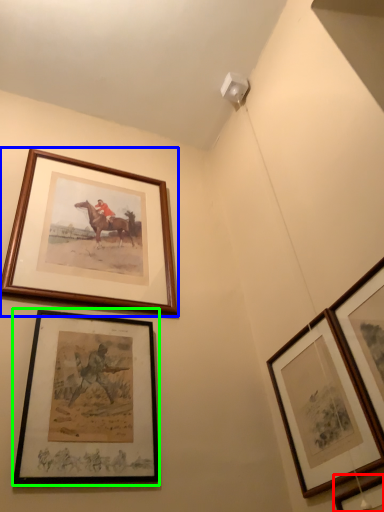
Question: Based on their relative distances, which object is farther from picture frame (highlighted by a red box)? Choose from picture frame (highlighted by a blue box) and picture frame (highlighted by a green box).

Choices:
 (A) picture frame
 (B) picture frame

Answer: (A)